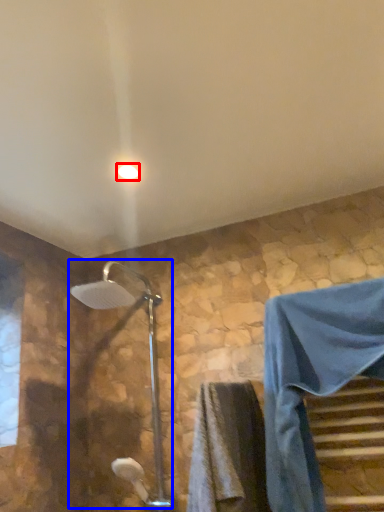
Question: Which point is further to the camera, light fixture (highlighted by a red box) or shower (highlighted by a blue box)?

Choices:
 (A) light fixture
 (B) shower

Answer: (A)